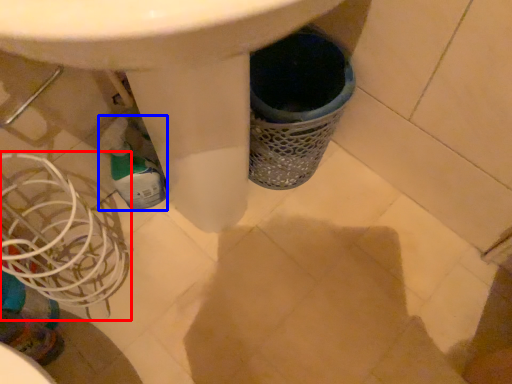
Question: Which object is further to the camera taking this photo, basket (highlighted by a red box) or bottle (highlighted by a blue box)?

Choices:
 (A) basket
 (B) bottle

Answer: (B)